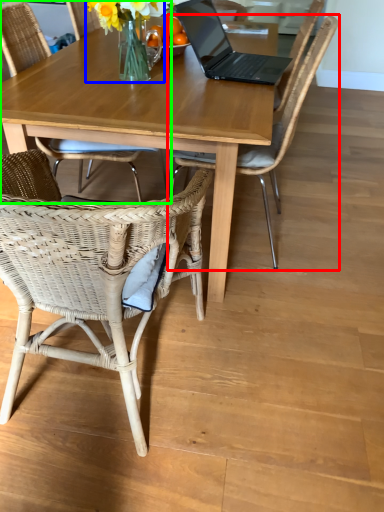
Question: Which object is positioned farthest from chair (highlighted by a red box)? Select from floral arrangement (highlighted by a blue box) and chair (highlighted by a green box).

Choices:
 (A) floral arrangement
 (B) chair

Answer: (A)